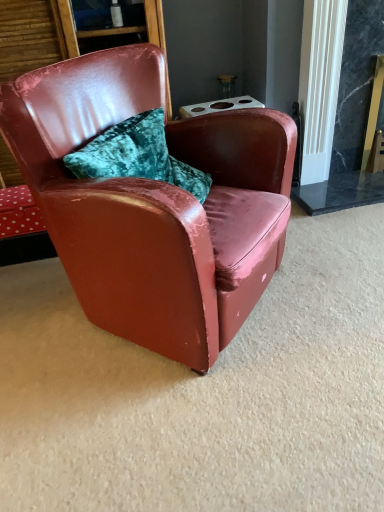
Where is `glossy leather chair at center`? This screenshot has width=384, height=512. glossy leather chair at center is located at coordinates (154, 204).

Describe the element at coordinates (154, 204) in the screenshot. I see `glossy leather chair at center` at that location.

Where is `glossy leather chair at center`? The image size is (384, 512). glossy leather chair at center is located at coordinates (154, 204).